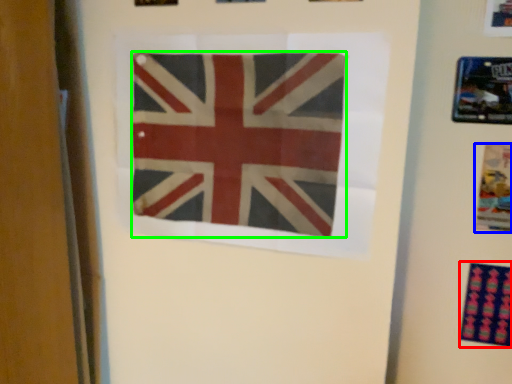
Question: Based on their relative distances, which object is nearer to print (highlighted by a red box)? Choose from poster (highlighted by a blue box) and flag (highlighted by a green box).

Choices:
 (A) poster
 (B) flag

Answer: (A)